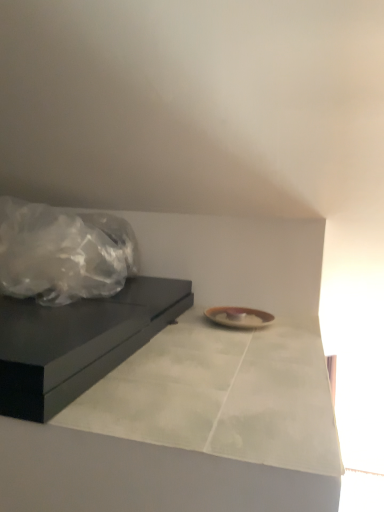
Question: Considering the relative positions of matte black table at left and white marble countertop at center in the image provided, is matte black table at left behind white marble countertop at center?

Choices:
 (A) yes
 (B) no

Answer: (A)

Question: Could you tell me if matte black table at left is turned towards white marble countertop at center?

Choices:
 (A) yes
 (B) no

Answer: (B)

Question: Considering the relative sizes of matte black table at left and white marble countertop at center in the image provided, is matte black table at left wider than white marble countertop at center?

Choices:
 (A) no
 (B) yes

Answer: (B)

Question: Is matte black table at left oriented away from white marble countertop at center?

Choices:
 (A) no
 (B) yes

Answer: (A)

Question: Is matte black table at left closer to the viewer compared to white marble countertop at center?

Choices:
 (A) yes
 (B) no

Answer: (B)

Question: Considering the relative sizes of matte black table at left and white marble countertop at center in the image provided, is matte black table at left taller than white marble countertop at center?

Choices:
 (A) no
 (B) yes

Answer: (B)

Question: Does white marble countertop at center have a greater height compared to matte black table at left?

Choices:
 (A) no
 (B) yes

Answer: (A)

Question: Does white marble countertop at center turn towards matte black table at left?

Choices:
 (A) no
 (B) yes

Answer: (A)

Question: Considering the relative positions of white marble countertop at center and matte black table at left in the image provided, is white marble countertop at center to the left of matte black table at left from the viewer's perspective?

Choices:
 (A) yes
 (B) no

Answer: (B)

Question: From a real-world perspective, is white marble countertop at center on matte black table at left?

Choices:
 (A) no
 (B) yes

Answer: (A)

Question: Is white marble countertop at center far away from matte black table at left?

Choices:
 (A) yes
 (B) no

Answer: (B)

Question: From the image's perspective, does white marble countertop at center appear lower than matte black table at left?

Choices:
 (A) no
 (B) yes

Answer: (B)

Question: From their relative heights in the image, would you say matte black table at left is taller or shorter than white marble countertop at center?

Choices:
 (A) short
 (B) tall

Answer: (B)